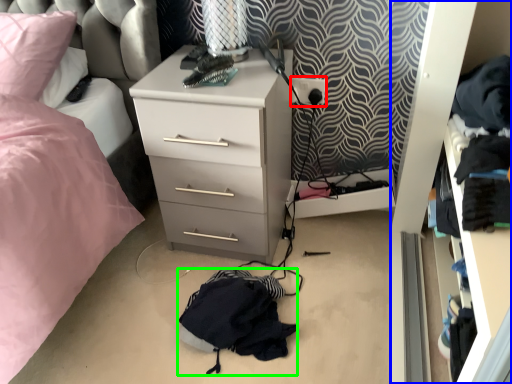
Question: Based on their relative distances, which object is farther from electric outlet (highlighted by a red box)? Choose from dresser (highlighted by a blue box) and clothing (highlighted by a green box).

Choices:
 (A) dresser
 (B) clothing

Answer: (B)